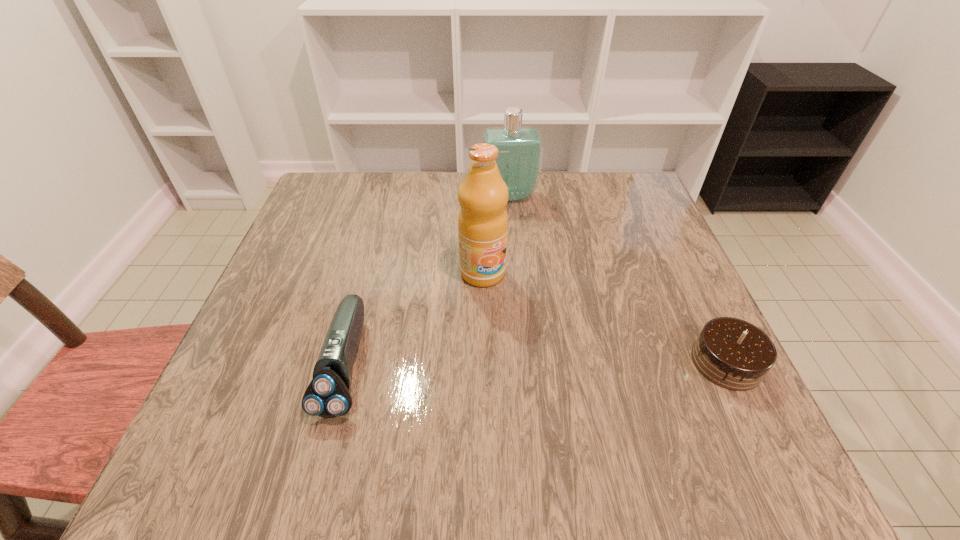
Identify the location of vacant space at the left edge of the desktop. (357, 240).

Where is `vacant space at the right edge of the desktop`? The image size is (960, 540). vacant space at the right edge of the desktop is located at coordinates (606, 223).

What are the coordinates of `free space at the far left corner` in the screenshot? It's located at (325, 186).

What are the coordinates of `vacant region at the far right corner of the desktop` in the screenshot? It's located at (655, 222).

This screenshot has width=960, height=540. Identify the location of free space between the chocolate cake and the fruit juice. (605, 318).

At what (x,y) coordinates should I click in order to perform the action: click on vacant region between the leftmost object and the third shortest object. Please return your answer as a coordinate pair (x, y). This screenshot has height=540, width=960. Looking at the image, I should click on (427, 280).

Find the location of a particular element. empty space between the farthest object and the electric shaver is located at coordinates (427, 280).

At what (x,y) coordinates should I click in order to perform the action: click on vacant point located between the rightmost object and the electric shaver. Please return your answer as a coordinate pair (x, y). This screenshot has width=960, height=540. Looking at the image, I should click on (536, 363).

At what (x,y) coordinates should I click in order to perform the action: click on free space between the perfume and the electric shaver. Please return your answer as a coordinate pair (x, y). The width and height of the screenshot is (960, 540). Looking at the image, I should click on (427, 280).

The image size is (960, 540). I want to click on vacant space in between the chocolate cake and the electric shaver, so click(536, 363).